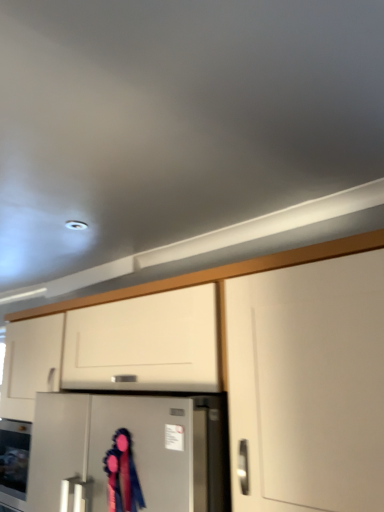
Question: From the image's perspective, is satin silver refrigerator at center on top of velvet ribbon at center?

Choices:
 (A) yes
 (B) no

Answer: (B)

Question: Can you confirm if satin silver refrigerator at center is thinner than velvet ribbon at center?

Choices:
 (A) no
 (B) yes

Answer: (A)

Question: Would you say satin silver refrigerator at center is a long distance from velvet ribbon at center?

Choices:
 (A) yes
 (B) no

Answer: (B)

Question: Considering the relative positions of satin silver refrigerator at center and velvet ribbon at center in the image provided, is satin silver refrigerator at center in front of velvet ribbon at center?

Choices:
 (A) yes
 (B) no

Answer: (A)

Question: Does satin silver refrigerator at center have a greater width compared to velvet ribbon at center?

Choices:
 (A) yes
 (B) no

Answer: (A)

Question: Is white matte cabinet at center in front of or behind velvet ribbon at center in the image?

Choices:
 (A) front
 (B) behind

Answer: (A)

Question: From the image's perspective, is white matte cabinet at center positioned above or below velvet ribbon at center?

Choices:
 (A) above
 (B) below

Answer: (B)

Question: Based on their sizes in the image, would you say white matte cabinet at center is bigger or smaller than velvet ribbon at center?

Choices:
 (A) big
 (B) small

Answer: (A)

Question: Do you think white matte cabinet at center is within velvet ribbon at center, or outside of it?

Choices:
 (A) outside
 (B) inside

Answer: (A)

Question: From a real-world perspective, is velvet ribbon at center physically located above or below satin silver refrigerator at center?

Choices:
 (A) below
 (B) above

Answer: (B)

Question: Looking at the image, does velvet ribbon at center seem bigger or smaller compared to satin silver refrigerator at center?

Choices:
 (A) big
 (B) small

Answer: (B)

Question: In terms of height, does velvet ribbon at center look taller or shorter compared to satin silver refrigerator at center?

Choices:
 (A) short
 (B) tall

Answer: (A)

Question: Considering their positions, is velvet ribbon at center located in front of or behind satin silver refrigerator at center?

Choices:
 (A) front
 (B) behind

Answer: (B)

Question: Considering the positions of satin silver refrigerator at center and white matte cabinet at center in the image, is satin silver refrigerator at center wider or thinner than white matte cabinet at center?

Choices:
 (A) thin
 (B) wide

Answer: (B)

Question: Which is correct: satin silver refrigerator at center is inside white matte cabinet at center, or outside of it?

Choices:
 (A) outside
 (B) inside

Answer: (B)